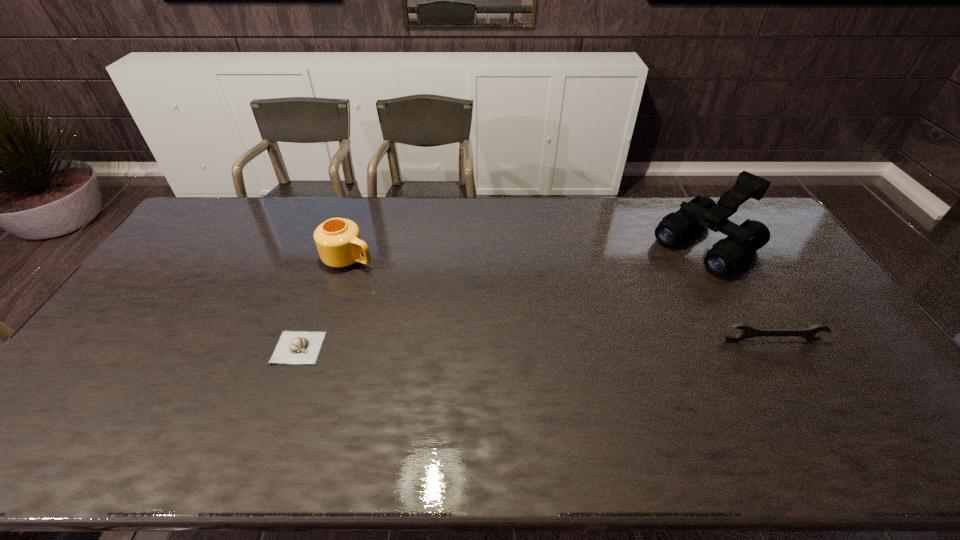
In order to click on empty location between the third tallest object and the mug in this screenshot , I will do `click(560, 299)`.

Find the location of `free point between the second shortest object and the tallest object`. free point between the second shortest object and the tallest object is located at coordinates (738, 293).

Find the location of a particular element. vacant region between the mug and the garlic is located at coordinates (324, 303).

The width and height of the screenshot is (960, 540). What are the coordinates of `free space between the mug and the third tallest object` in the screenshot? It's located at (560, 299).

This screenshot has height=540, width=960. Find the location of `free space between the binoculars and the third shortest object`. free space between the binoculars and the third shortest object is located at coordinates (528, 252).

Identify the location of free spot between the second tallest object and the third tallest object. (560, 299).

You are a GUI agent. You are given a task and a screenshot of the screen. Output one action in this format:
    pyautogui.click(x=<x>, y=<y>)
    Task: Click on the empty space that is in between the mug and the shortest object
    The width and height of the screenshot is (960, 540).
    Given the screenshot: What is the action you would take?
    pyautogui.click(x=324, y=303)

The image size is (960, 540). In order to click on free space between the second tallest object and the shortest object in this screenshot , I will do `click(324, 303)`.

Locate an element on the screen. unoccupied position between the wrench and the garlic is located at coordinates (535, 344).

Image resolution: width=960 pixels, height=540 pixels. What are the coordinates of `vacant space that is in between the mug and the garlic` in the screenshot? It's located at (324, 303).